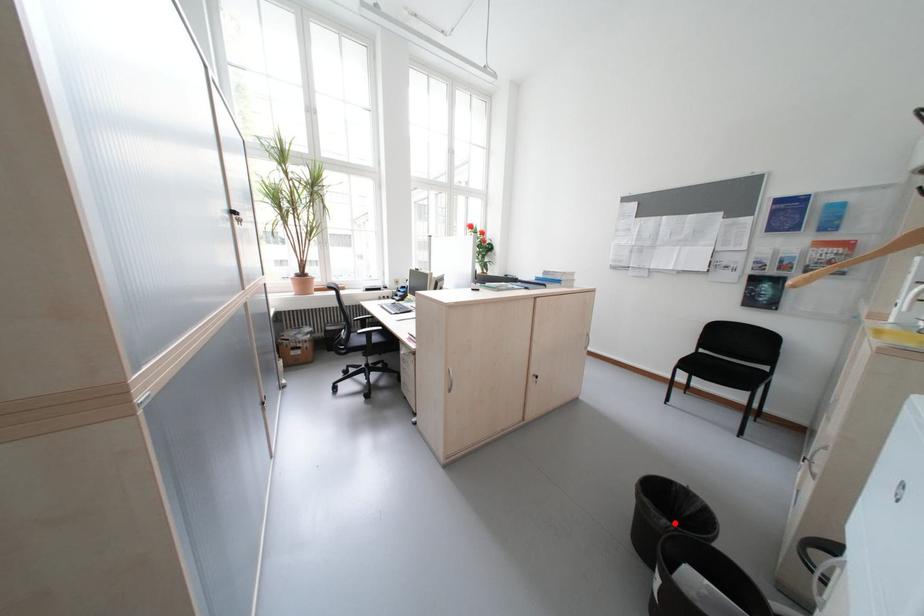
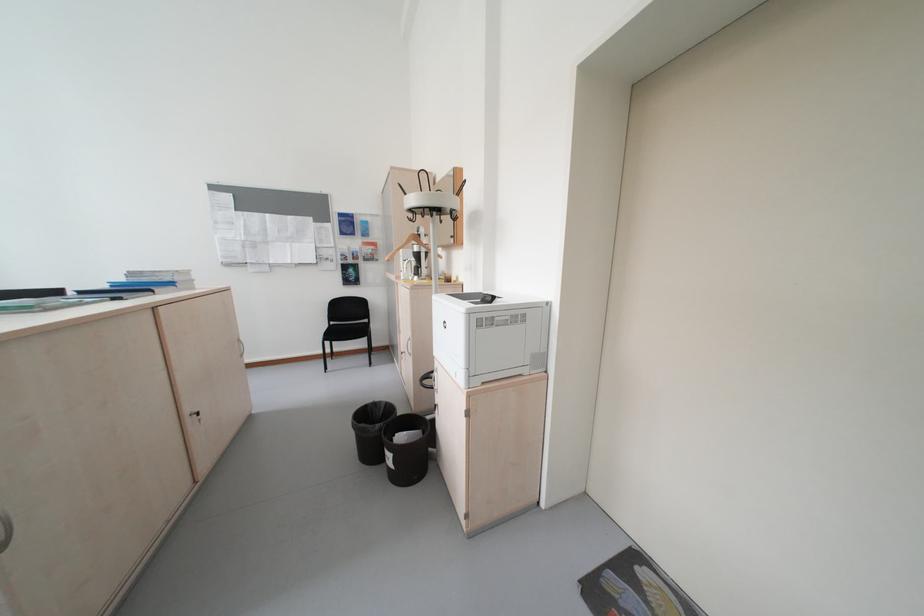
Locate, in the second image, the point that corresponds to the highlighted location in the first image.

(388, 427)